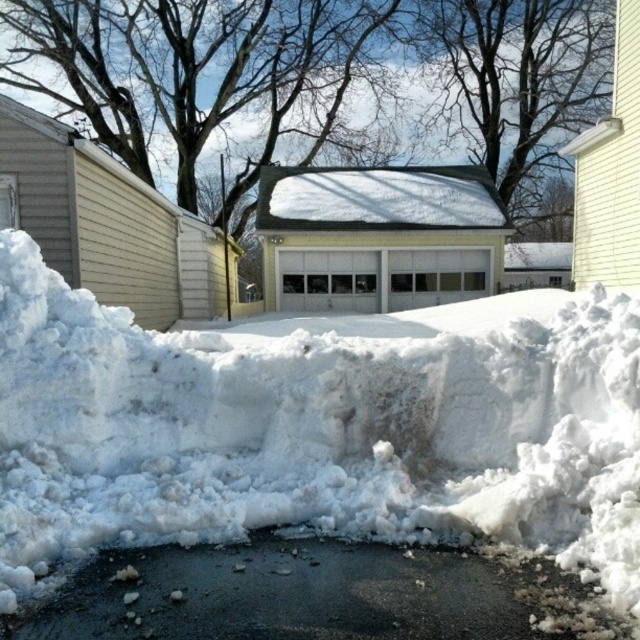
Question: Does white fluffy snow at center appear under black asphalt at center?

Choices:
 (A) no
 (B) yes

Answer: (A)

Question: Which point is farther to the camera?

Choices:
 (A) (417, 419)
 (B) (465, 604)

Answer: (A)

Question: Which point is closer to the camera?

Choices:
 (A) (141, 600)
 (B) (173, 385)

Answer: (A)

Question: Which point is closer to the camera?

Choices:
 (A) (76, 323)
 (B) (58, 605)

Answer: (B)

Question: Considering the relative positions of white fluffy snow at center and black asphalt at center in the image provided, where is white fluffy snow at center located with respect to black asphalt at center?

Choices:
 (A) right
 (B) left

Answer: (A)

Question: Is white fluffy snow at center smaller than black asphalt at center?

Choices:
 (A) yes
 (B) no

Answer: (A)